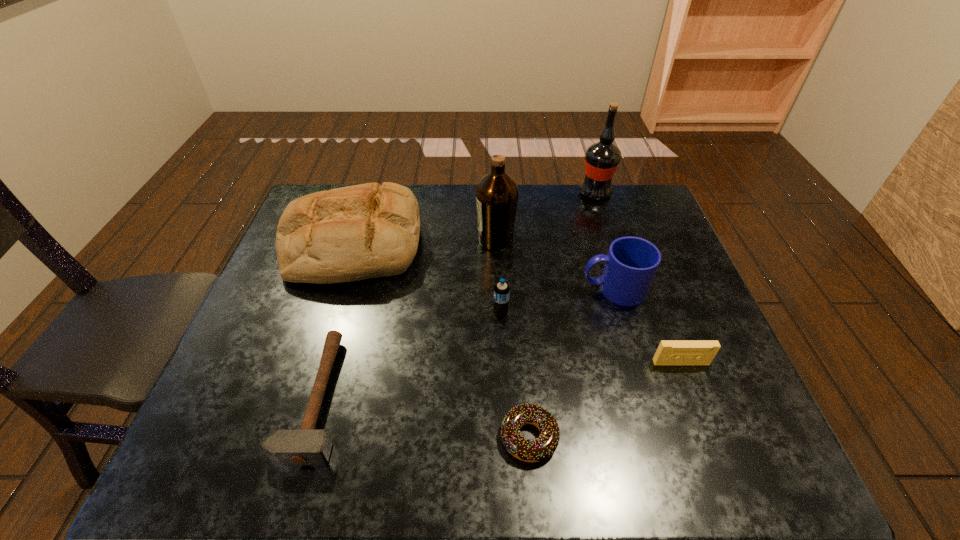
This screenshot has height=540, width=960. I want to click on vacant point located between the fourth nearest object and the third shortest object, so click(x=590, y=338).

The image size is (960, 540). Identify the location of vacant space that's between the sixth tallest object and the fifth farthest object. (590, 338).

At what (x,y) coordinates should I click in order to perform the action: click on vacant space that's between the shortest object and the bread. Please return your answer as a coordinate pair (x, y). This screenshot has height=540, width=960. Looking at the image, I should click on (x=442, y=341).

Locate an element on the screen. This screenshot has width=960, height=540. free space between the shortest object and the olive oil is located at coordinates (513, 339).

Where is `free space between the hammer and the mug`? free space between the hammer and the mug is located at coordinates (465, 343).

The width and height of the screenshot is (960, 540). In order to click on free space between the mug and the olive oil in this screenshot , I will do `click(555, 265)`.

Point out which object is positioned as the nearest to the hammer. Please provide its 2D coordinates. Your answer should be formatted as a tuple, i.e. [(x, y)], where the tuple contains the x and y coordinates of a point satisfying the conditions above.

[(347, 234)]

Point out which object is positioned as the second nearest to the hammer. Please provide its 2D coordinates. Your answer should be formatted as a tuple, i.e. [(x, y)], where the tuple contains the x and y coordinates of a point satisfying the conditions above.

[(501, 291)]

Identify the location of free region that satisfies the following two spatial constraints: 1. on the label of the soda bottle; 2. on the right side of the olive oil. This screenshot has width=960, height=540. (498, 313).